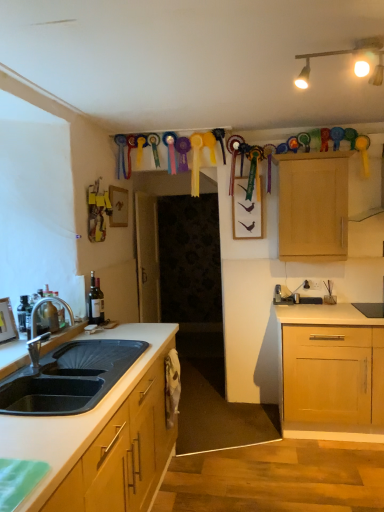
Question: Is the depth of matte gold track lights at upper center greater than that of brushed metal faucet at sink left?

Choices:
 (A) no
 (B) yes

Answer: (A)

Question: Is matte gold track lights at upper center bigger than brushed metal faucet at sink left?

Choices:
 (A) yes
 (B) no

Answer: (A)

Question: Does matte gold track lights at upper center have a greater width compared to brushed metal faucet at sink left?

Choices:
 (A) no
 (B) yes

Answer: (B)

Question: Can you confirm if matte gold track lights at upper center is positioned to the left of brushed metal faucet at sink left?

Choices:
 (A) no
 (B) yes

Answer: (A)

Question: From a real-world perspective, is matte gold track lights at upper center beneath brushed metal faucet at sink left?

Choices:
 (A) no
 (B) yes

Answer: (A)

Question: Is brushed metal faucet at sink left in front of or behind wooden picture frame at left in the image?

Choices:
 (A) behind
 (B) front

Answer: (B)

Question: Looking at their shapes, would you say brushed metal faucet at sink left is wider or thinner than wooden picture frame at left?

Choices:
 (A) wide
 (B) thin

Answer: (A)

Question: From the image's perspective, is brushed metal faucet at sink left positioned above or below wooden picture frame at left?

Choices:
 (A) above
 (B) below

Answer: (A)

Question: From a real-world perspective, is brushed metal faucet at sink left positioned above or below wooden picture frame at left?

Choices:
 (A) below
 (B) above

Answer: (B)

Question: In terms of width, does wooden picture frame at left look wider or thinner when compared to brushed metal faucet at sink left?

Choices:
 (A) thin
 (B) wide

Answer: (A)

Question: From a real-world perspective, is wooden picture frame at left physically located above or below brushed metal faucet at sink left?

Choices:
 (A) below
 (B) above

Answer: (A)

Question: Is wooden picture frame at left bigger or smaller than brushed metal faucet at sink left?

Choices:
 (A) small
 (B) big

Answer: (A)

Question: Considering the relative positions of wooden picture frame at left and brushed metal faucet at sink left in the image provided, is wooden picture frame at left to the left or to the right of brushed metal faucet at sink left?

Choices:
 (A) right
 (B) left

Answer: (B)

Question: From their relative heights in the image, would you say brushed metal faucet at sink left is taller or shorter than light wood cabinet at upper right?

Choices:
 (A) short
 (B) tall

Answer: (A)

Question: Does point (66, 305) appear closer or farther from the camera than point (331, 172)?

Choices:
 (A) closer
 (B) farther

Answer: (A)